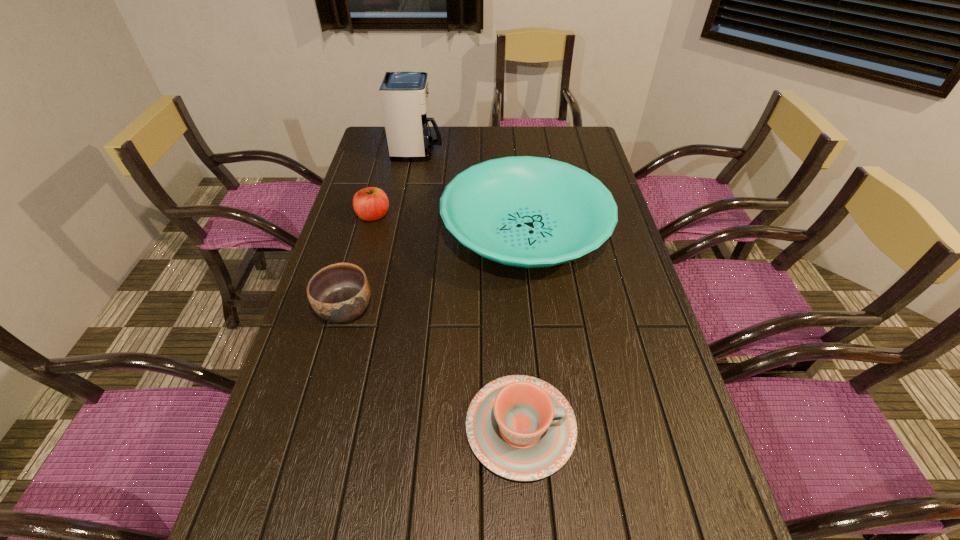
In the image, there is a desktop. At what (x,y) coordinates should I click in order to perform the action: click on vacant space at the right edge. Please return your answer as a coordinate pair (x, y). This screenshot has width=960, height=540. Looking at the image, I should click on (651, 469).

The height and width of the screenshot is (540, 960). In the image, there is a desktop. Find the location of `vacant space at the far left corner`. vacant space at the far left corner is located at coordinates (373, 141).

Where is `free space at the far right corner of the desktop`? The image size is (960, 540). free space at the far right corner of the desktop is located at coordinates (561, 139).

This screenshot has height=540, width=960. I want to click on free space between the coffee maker and the apple, so click(396, 184).

Identify the location of free space between the chinaware and the apple. This screenshot has width=960, height=540. click(x=447, y=322).

The height and width of the screenshot is (540, 960). Find the location of `vacant area between the tallest object and the apple`. vacant area between the tallest object and the apple is located at coordinates (396, 184).

Locate an element on the screen. the fourth closest object to the dish is located at coordinates (521, 428).

Where is `object that is the closest to the nearest object`? This screenshot has height=540, width=960. object that is the closest to the nearest object is located at coordinates (531, 212).

Locate an element on the screen. The height and width of the screenshot is (540, 960). free space that satisfies the following two spatial constraints: 1. on the front panel of the coffee maker; 2. on the front side of the bowl is located at coordinates (388, 309).

At what (x,y) coordinates should I click in order to perform the action: click on vacant area that satisfies the following two spatial constraints: 1. on the back side of the dish; 2. on the left side of the bowl. Please return your answer as a coordinate pair (x, y). The image size is (960, 540). Looking at the image, I should click on (367, 233).